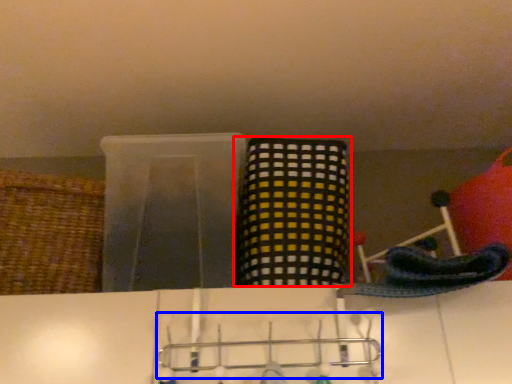
Question: Which object is further to the camera taking this photo, basket (highlighted by a red box) or hanger (highlighted by a blue box)?

Choices:
 (A) basket
 (B) hanger

Answer: (A)